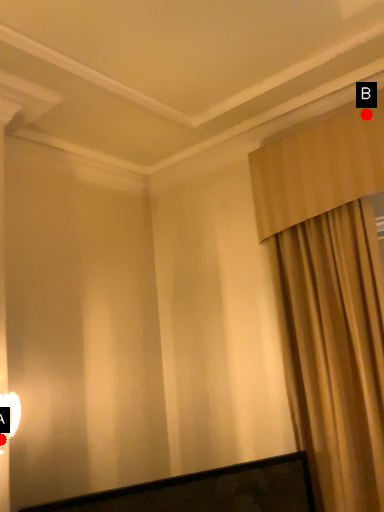
Question: Two points are circled on the image, labeled by A and B beside each circle. Which point is closer to the camera?

Choices:
 (A) A is closer
 (B) B is closer

Answer: (A)